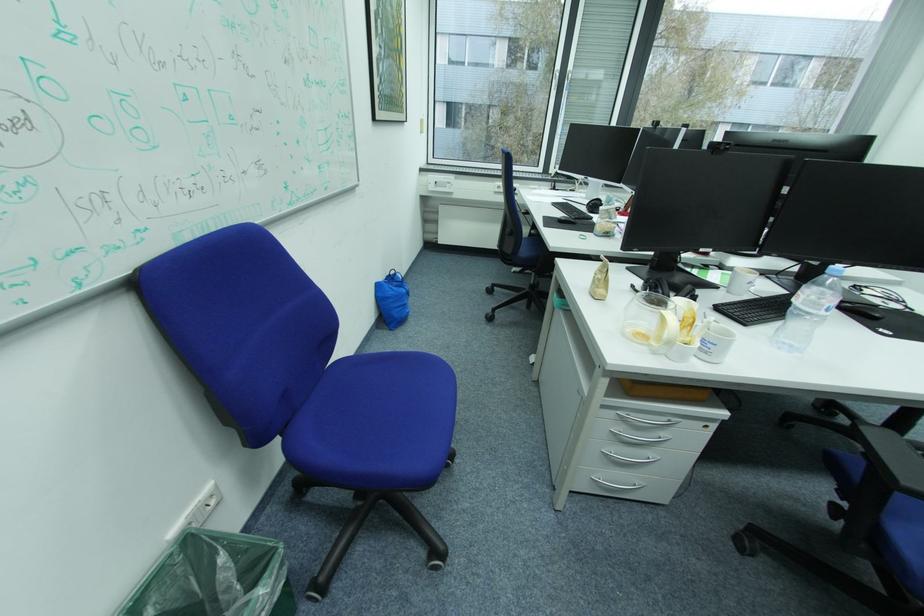
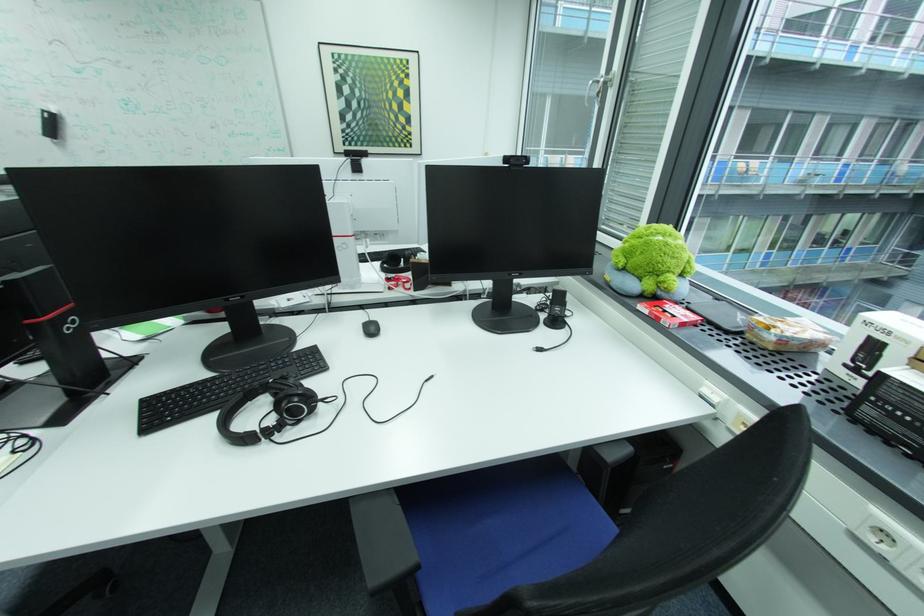
In the second image, find the point that corresponds to pixel 383 120 in the first image.

(344, 153)